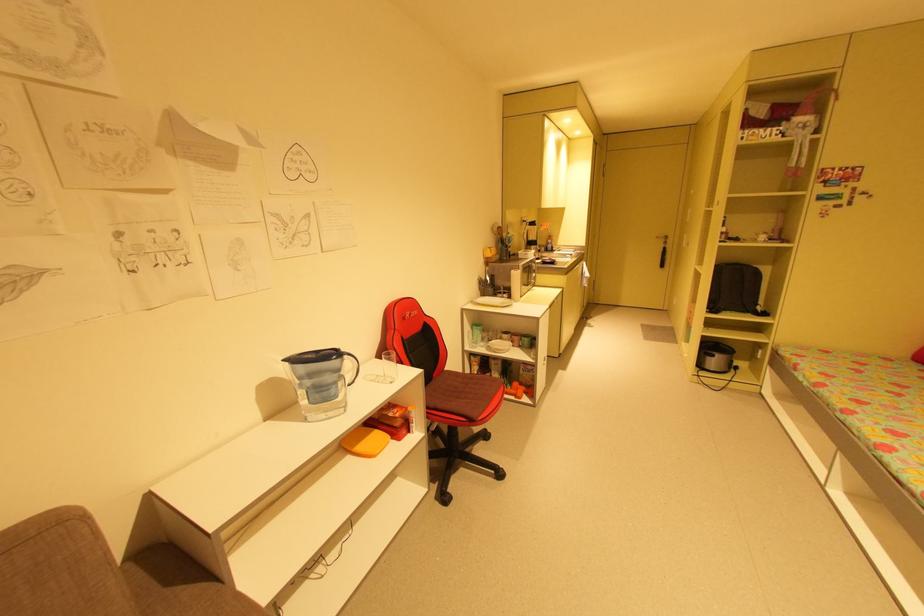
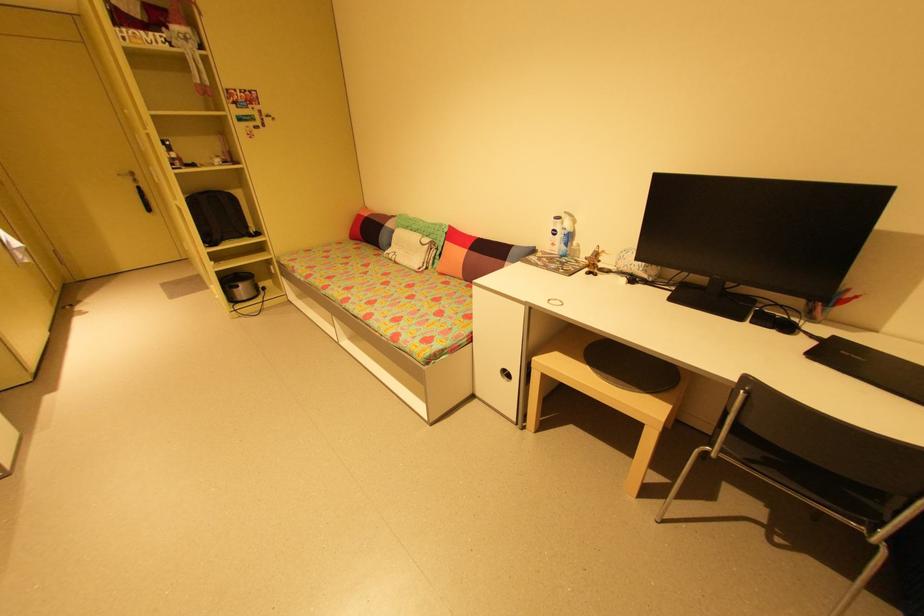
The point at (x=665, y=251) is marked in the first image. Where is the corresponding point in the second image?

(140, 191)